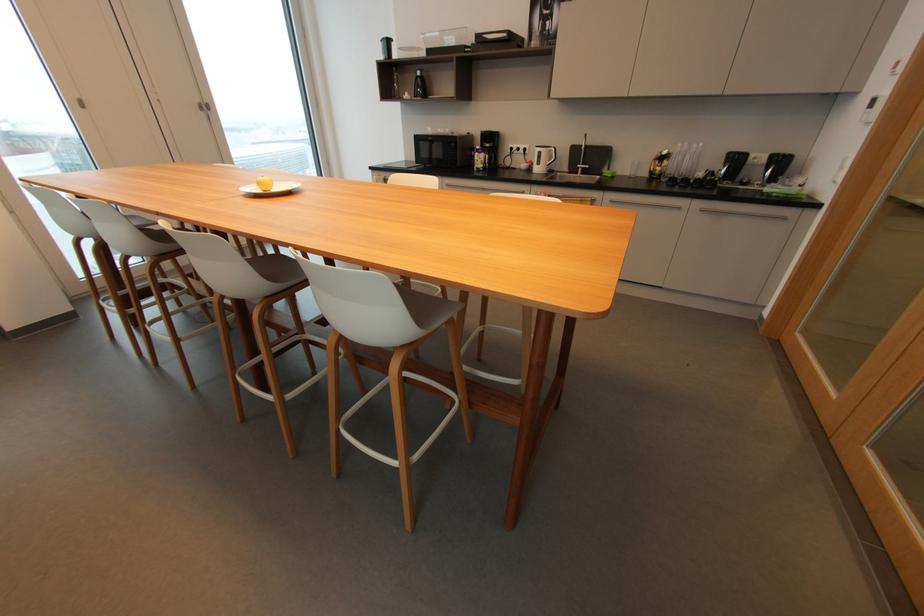
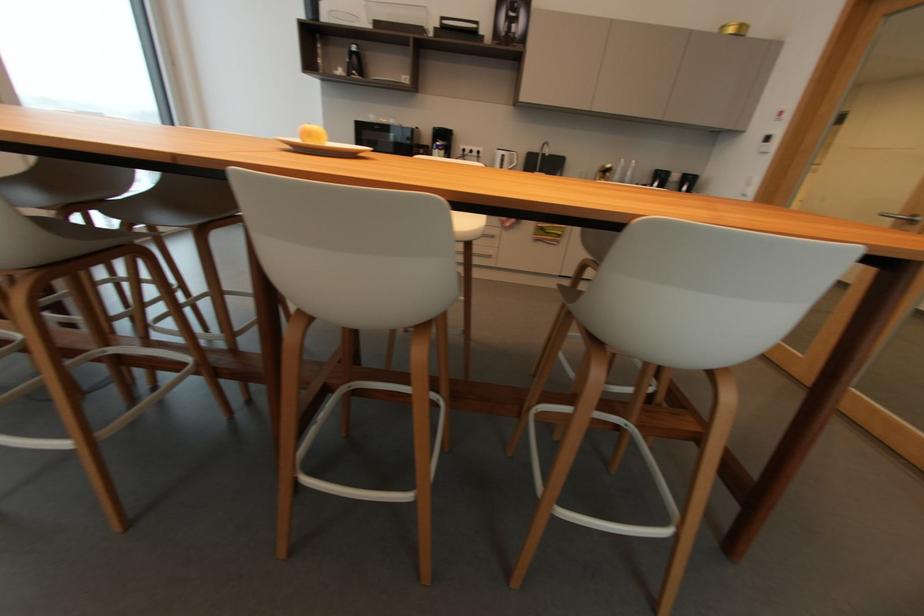
What movement of the cameraman would produce the second image?

The cameraman moved toward left, forward.